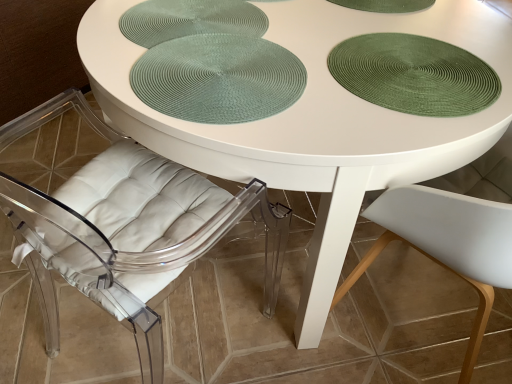
Question: From a real-world perspective, is green textured placemat at upper right, which is the 1th glass plate in right-to-left order, physically below transparent acrylic chair at lower left?

Choices:
 (A) no
 (B) yes

Answer: (A)

Question: From a real-world perspective, is green textured placemat at upper right, positioned as the 2th glass plate in left-to-right order, on top of transparent acrylic chair at lower left?

Choices:
 (A) no
 (B) yes

Answer: (B)

Question: Is the depth of green textured placemat at upper right, positioned as the 2th glass plate in left-to-right order, less than that of transparent acrylic chair at lower left?

Choices:
 (A) yes
 (B) no

Answer: (B)

Question: Is green textured placemat at upper right, positioned as the 2th glass plate in left-to-right order, at the left side of transparent acrylic chair at lower left?

Choices:
 (A) no
 (B) yes

Answer: (A)

Question: Considering the relative positions of green textured placemat at upper right, which is the 1th glass plate in right-to-left order, and transparent acrylic chair at lower left in the image provided, is green textured placemat at upper right, which is the 1th glass plate in right-to-left order, behind transparent acrylic chair at lower left?

Choices:
 (A) no
 (B) yes

Answer: (B)

Question: Is green woven placemat at center wider or thinner than green woven placemat at upper center, which ranks as the first glass plate in left-to-right order?

Choices:
 (A) wide
 (B) thin

Answer: (B)

Question: From the image's perspective, is green woven placemat at center located above or below green woven placemat at upper center, which ranks as the first glass plate in left-to-right order?

Choices:
 (A) below
 (B) above

Answer: (A)

Question: Is point (204, 119) closer or farther from the camera than point (166, 34)?

Choices:
 (A) farther
 (B) closer

Answer: (B)

Question: In terms of height, does green woven placemat at center look taller or shorter compared to green woven placemat at upper center, which ranks as the first glass plate in left-to-right order?

Choices:
 (A) short
 (B) tall

Answer: (B)

Question: From a real-world perspective, is transparent acrylic chair at lower left positioned above or below green woven placemat at upper center, which ranks as the first glass plate in left-to-right order?

Choices:
 (A) below
 (B) above

Answer: (A)

Question: Considering their positions, is transparent acrylic chair at lower left located in front of or behind green woven placemat at upper center, which ranks as the 2th glass plate in right-to-left order?

Choices:
 (A) front
 (B) behind

Answer: (A)

Question: In terms of size, does transparent acrylic chair at lower left appear bigger or smaller than green woven placemat at upper center, which ranks as the first glass plate in left-to-right order?

Choices:
 (A) big
 (B) small

Answer: (A)

Question: From the image's perspective, is transparent acrylic chair at lower left above or below green woven placemat at upper center, which ranks as the 2th glass plate in right-to-left order?

Choices:
 (A) below
 (B) above

Answer: (A)

Question: From the image's perspective, is green textured placemat at upper right, which is the 1th glass plate in right-to-left order, positioned above or below transparent acrylic chair at lower left?

Choices:
 (A) below
 (B) above

Answer: (B)

Question: In terms of width, does green textured placemat at upper right, which is the 1th glass plate in right-to-left order, look wider or thinner when compared to transparent acrylic chair at lower left?

Choices:
 (A) thin
 (B) wide

Answer: (A)